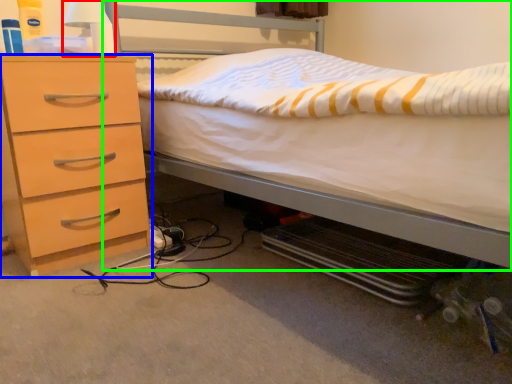
Question: Which object is the farthest from bedside lamp (highlighted by a red box)? Choose among these: chest of drawers (highlighted by a blue box) or bed (highlighted by a green box).

Choices:
 (A) chest of drawers
 (B) bed

Answer: (B)